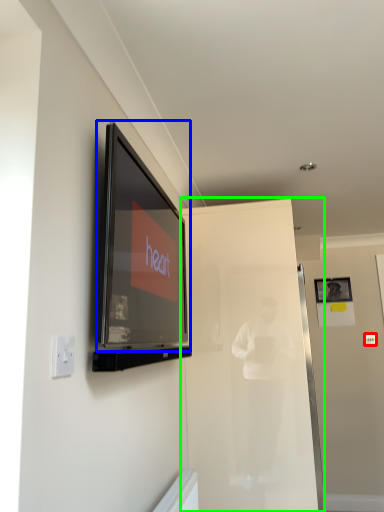
Question: Based on their relative distances, which object is nearer to light switch (highlighted by a red box)? Choose from television (highlighted by a blue box) and glass door (highlighted by a green box).

Choices:
 (A) television
 (B) glass door

Answer: (B)